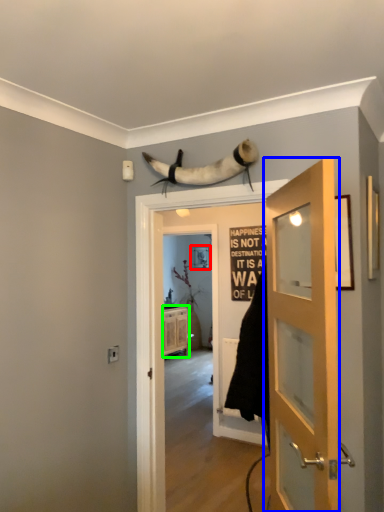
Question: Considering the real-world distances, which object is farthest from picture frame (highlighted by a red box)? door (highlighted by a blue box) or cabinetry (highlighted by a green box)?

Choices:
 (A) door
 (B) cabinetry

Answer: (A)